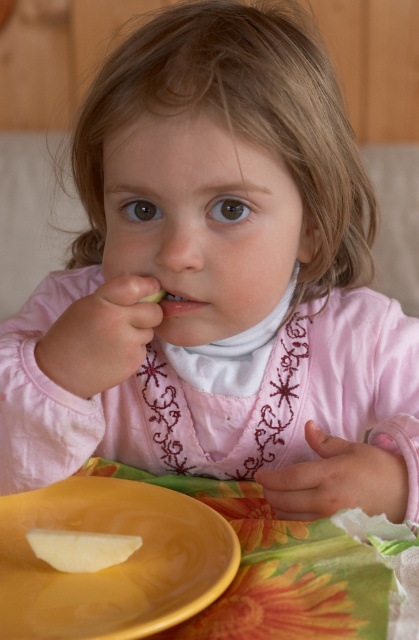
From the picture: You are a parent trying to ensure your child eats their apple slice. The yellow matte plate at lower left and the white matte apple slice at lower left are both on the table. Which item is larger in width?

The yellow matte plate at lower left might be wider than the white matte apple slice at lower left, so the plate is likely larger in width.

You are a parent trying to locate your child who is sitting at a table. The yellow matte plate at lower left is on the table. Based on the coordinates provided, where should you look relative to the plate to find the child?

The child is sitting at the table, so the yellow matte plate at lower left is placed in front of them. Since the plate is at coordinates point (x=113, y=564), the child would be positioned opposite the plate, likely facing towards it from the other side of the table.

The child is trying to pick up the white matte apple slice at lower left using a spoon. The spoon can only reach items within 10 cm from the edge of the yellow matte plate at lower left. Can the child reach the apple slice with the spoon?

The yellow matte plate at lower left is larger than the white matte apple slice at lower left, so the apple slice is likely within the plate. Since the spoon can reach 10 cm from the edge of the plate, the child can reach the apple slice with the spoon.